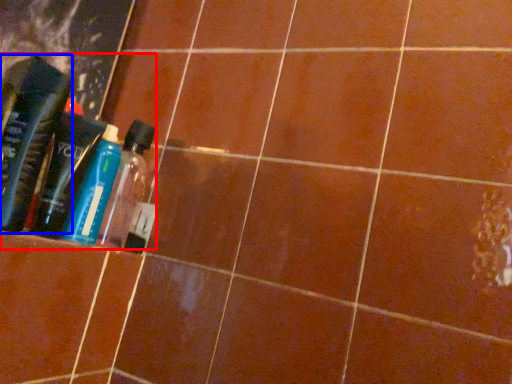
Question: Among these objects, which one is nearest to the camera, product (highlighted by a red box) or bottle (highlighted by a blue box)?

Choices:
 (A) product
 (B) bottle

Answer: (B)